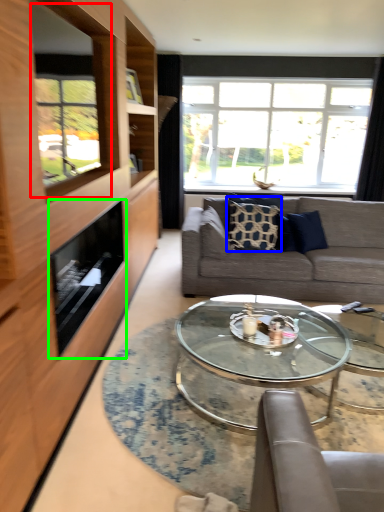
Question: Estimate the real-world distances between objects in this image. Which object is closer to window screen (highlighted by a red box), pillow (highlighted by a blue box) or appliance (highlighted by a green box)?

Choices:
 (A) pillow
 (B) appliance

Answer: (B)